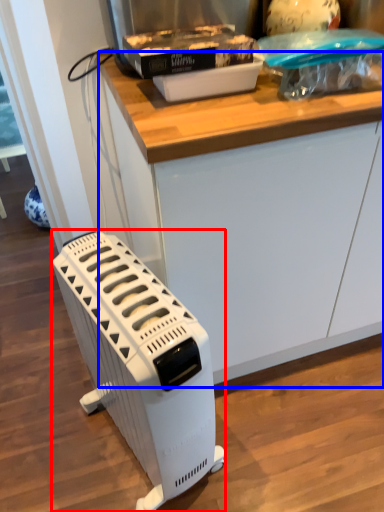
Question: Which of the following is the closest to the observer, home appliance (highlighted by a red box) or counter (highlighted by a blue box)?

Choices:
 (A) home appliance
 (B) counter

Answer: (A)